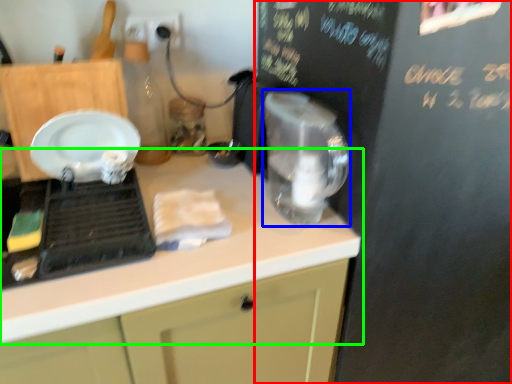
Question: Which object is the farthest from bulletin board (highlighted by a red box)? Choose among these: appliance (highlighted by a blue box) or countertop (highlighted by a green box).

Choices:
 (A) appliance
 (B) countertop

Answer: (B)